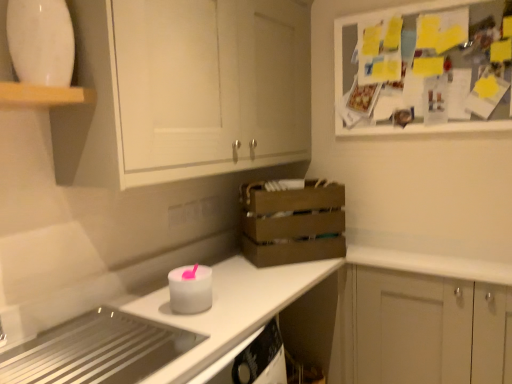
The image size is (512, 384). What are the coordinates of `unoccupied region to the right of white matte candle at center, the 2th appliance ordered from the bottom` in the screenshot? It's located at (236, 306).